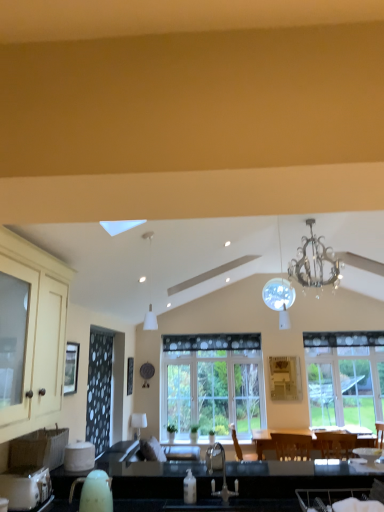
Question: From a real-world perspective, is silver metallic chandelier at upper center, the second light fixture when ordered from left to right, positioned over clear glass window screen at left based on gravity?

Choices:
 (A) yes
 (B) no

Answer: (A)

Question: Is silver metallic chandelier at upper center, which ranks as the first light fixture in back-to-front order, positioned far away from clear glass window screen at left?

Choices:
 (A) yes
 (B) no

Answer: (A)

Question: From the image's perspective, is silver metallic chandelier at upper center, which ranks as the first light fixture in back-to-front order, located above clear glass window screen at left?

Choices:
 (A) yes
 (B) no

Answer: (A)

Question: Does silver metallic chandelier at upper center, which is counted as the 1th light fixture, starting from the right, appear on the right side of clear glass window screen at left?

Choices:
 (A) no
 (B) yes

Answer: (B)

Question: Is silver metallic chandelier at upper center, which ranks as the first light fixture in back-to-front order, further to the viewer compared to clear glass window screen at left?

Choices:
 (A) no
 (B) yes

Answer: (B)

Question: Considering the positions of black matte sink at lower center and clear glass window screen at left in the image, is black matte sink at lower center wider or thinner than clear glass window screen at left?

Choices:
 (A) thin
 (B) wide

Answer: (B)

Question: Considering the positions of black matte sink at lower center and clear glass window screen at left in the image, is black matte sink at lower center taller or shorter than clear glass window screen at left?

Choices:
 (A) short
 (B) tall

Answer: (A)

Question: Is black matte sink at lower center in front of or behind clear glass window screen at left in the image?

Choices:
 (A) front
 (B) behind

Answer: (A)

Question: Would you say black matte sink at lower center is inside or outside clear glass window screen at left?

Choices:
 (A) inside
 (B) outside

Answer: (B)

Question: Looking at the image, does clear glass window screen at left seem bigger or smaller compared to silver metallic chandelier at upper center, which is counted as the 1th light fixture, starting from the right?

Choices:
 (A) small
 (B) big

Answer: (A)

Question: In the image, is clear glass window screen at left positioned in front of or behind silver metallic chandelier at upper center, the second light fixture when ordered from left to right?

Choices:
 (A) front
 (B) behind

Answer: (A)

Question: Would you say clear glass window screen at left is to the left or to the right of silver metallic chandelier at upper center, marked as the second light fixture in a front-to-back arrangement, in the picture?

Choices:
 (A) left
 (B) right

Answer: (A)

Question: From their relative heights in the image, would you say clear glass window screen at left is taller or shorter than silver metallic chandelier at upper center, which is counted as the 1th light fixture, starting from the right?

Choices:
 (A) tall
 (B) short

Answer: (B)

Question: From a real-world perspective, is clear glass window at center, which ranks as the 1th window in right-to-left order, physically located above or below velvet dark brown armchair at lower right?

Choices:
 (A) below
 (B) above

Answer: (B)

Question: Considering the positions of point (350, 350) and point (316, 496), is point (350, 350) closer or farther from the camera than point (316, 496)?

Choices:
 (A) farther
 (B) closer

Answer: (A)